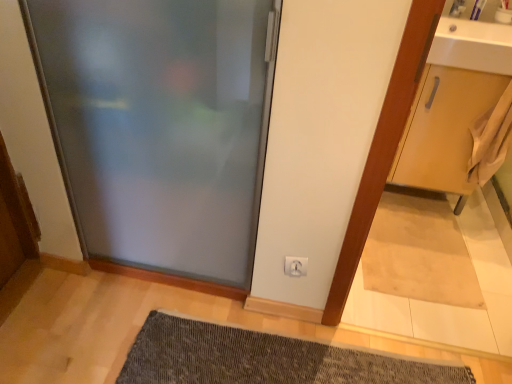
Question: Does white plastic electric outlet at lower center come behind frosted glass door at center?

Choices:
 (A) no
 (B) yes

Answer: (B)

Question: Considering the relative sizes of white plastic electric outlet at lower center and frosted glass door at center in the image provided, is white plastic electric outlet at lower center bigger than frosted glass door at center?

Choices:
 (A) no
 (B) yes

Answer: (A)

Question: From the image's perspective, does white plastic electric outlet at lower center appear lower than frosted glass door at center?

Choices:
 (A) no
 (B) yes

Answer: (B)

Question: Is white plastic electric outlet at lower center shorter than frosted glass door at center?

Choices:
 (A) yes
 (B) no

Answer: (A)

Question: Is white plastic electric outlet at lower center oriented towards frosted glass door at center?

Choices:
 (A) no
 (B) yes

Answer: (A)

Question: Considering the positions of point [451, 43] and point [304, 266], is point [451, 43] closer or farther from the camera than point [304, 266]?

Choices:
 (A) closer
 (B) farther

Answer: (B)

Question: In terms of height, does white glossy sink at upper right look taller or shorter compared to white plastic electric outlet at lower center?

Choices:
 (A) short
 (B) tall

Answer: (B)

Question: Choose the correct answer: Is white glossy sink at upper right inside white plastic electric outlet at lower center or outside it?

Choices:
 (A) inside
 (B) outside

Answer: (B)

Question: From the image's perspective, is white glossy sink at upper right located above or below white plastic electric outlet at lower center?

Choices:
 (A) below
 (B) above

Answer: (B)

Question: In the image, is dark gray textured bath mat at lower center on the left side or the right side of frosted glass door at center?

Choices:
 (A) right
 (B) left

Answer: (A)

Question: From a real-world perspective, relative to frosted glass door at center, is dark gray textured bath mat at lower center vertically above or below?

Choices:
 (A) below
 (B) above

Answer: (A)

Question: Considering their positions, is dark gray textured bath mat at lower center located in front of or behind frosted glass door at center?

Choices:
 (A) behind
 (B) front

Answer: (A)

Question: Considering the positions of dark gray textured bath mat at lower center and frosted glass door at center in the image, is dark gray textured bath mat at lower center wider or thinner than frosted glass door at center?

Choices:
 (A) wide
 (B) thin

Answer: (A)

Question: Would you say dark gray textured bath mat at lower center is inside or outside white glossy sink at upper right?

Choices:
 (A) outside
 (B) inside

Answer: (A)

Question: Considering the relative positions of dark gray textured bath mat at lower center and white glossy sink at upper right in the image provided, is dark gray textured bath mat at lower center to the left or to the right of white glossy sink at upper right?

Choices:
 (A) left
 (B) right

Answer: (A)